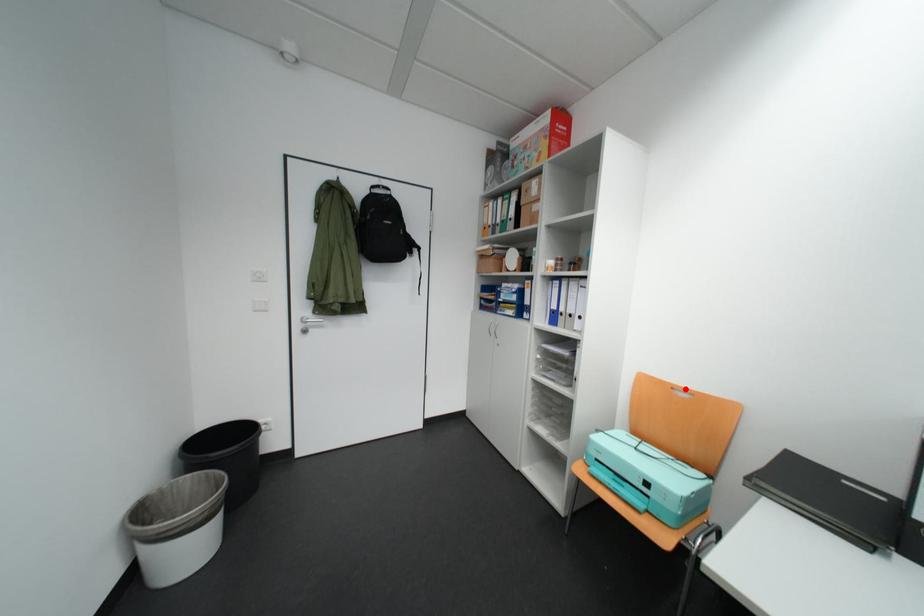
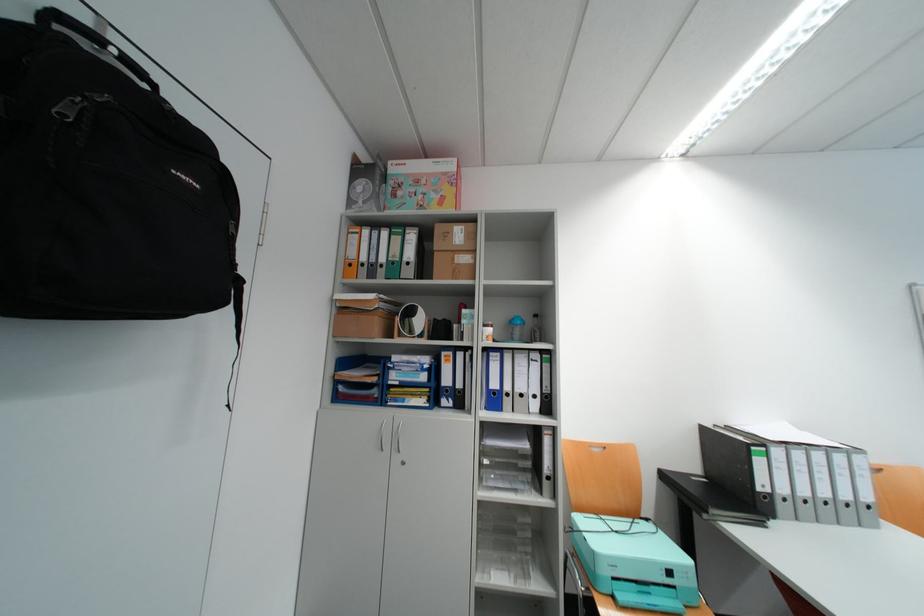
Question: I am providing you with two images of the same scene from different viewpoints. Given a red point in image1, look at the same physical point in image2. Is it:

Choices:
 (A) Closer to the viewpoint
 (B) Farther from the viewpoint

Answer: (B)